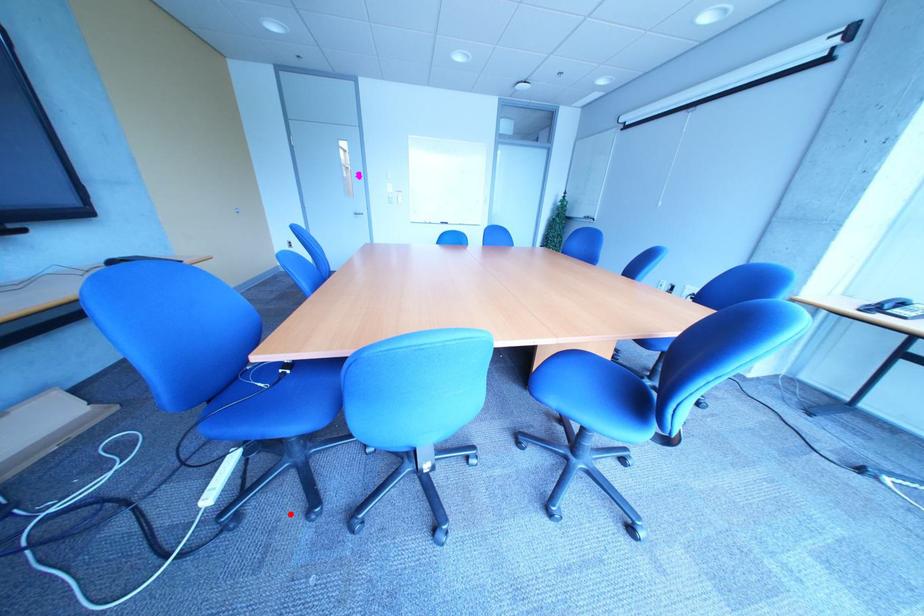
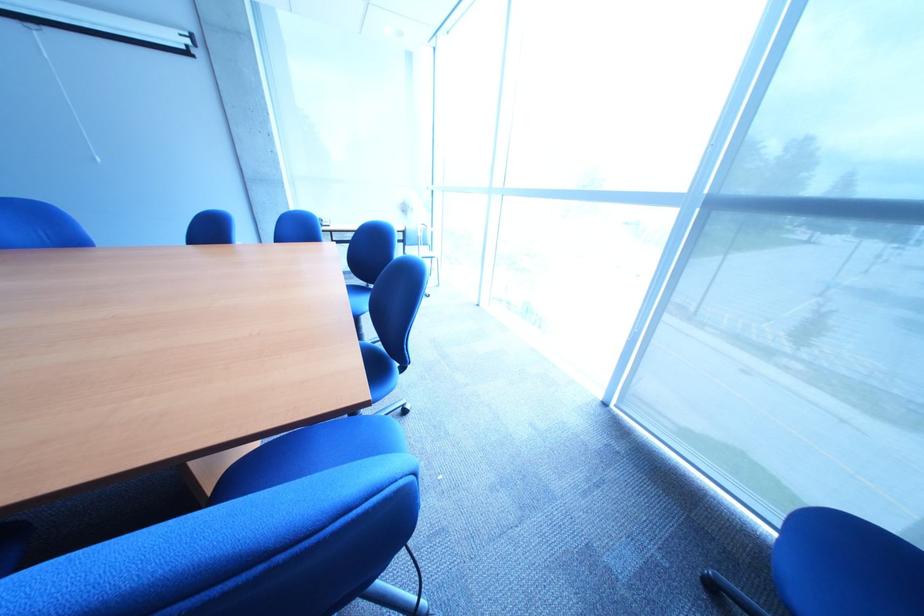
Question: I am providing you with two images of the same scene from different viewpoints. In image1, a red point is highlighted. Considering the same 3D point in image2, which of the following is correct?

Choices:
 (A) It is closer
 (B) It is farther

Answer: (A)